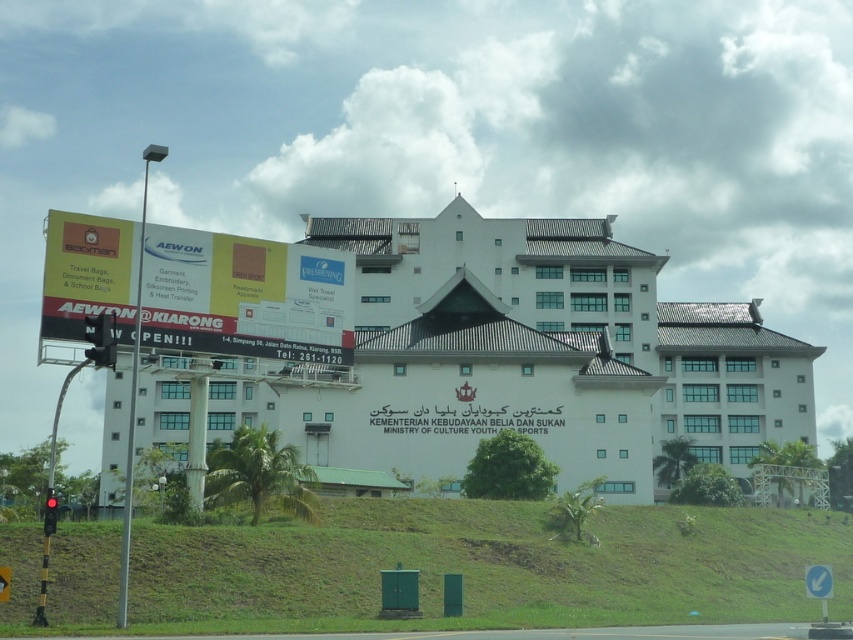
Question: Is white matte building at center positioned in front of red glass traffic light at left?

Choices:
 (A) no
 (B) yes

Answer: (A)

Question: Which is nearer to the red glass traffic light at left?

Choices:
 (A) white matte building at center
 (B) green grassy hillside at lower center

Answer: (B)

Question: Does white matte building at center have a lesser width compared to blue plastic arrow at lower right?

Choices:
 (A) no
 (B) yes

Answer: (A)

Question: Which object appears closest to the camera in this image?

Choices:
 (A) red glass traffic light at left
 (B) white matte building at center
 (C) blue plastic arrow at lower right

Answer: (C)

Question: Which object is closer to the camera taking this photo?

Choices:
 (A) red glass traffic light at left
 (B) white matte building at center
 (C) red matte traffic light at left

Answer: (C)

Question: Does green grassy hillside at lower center appear over blue plastic arrow at lower right?

Choices:
 (A) no
 (B) yes

Answer: (A)